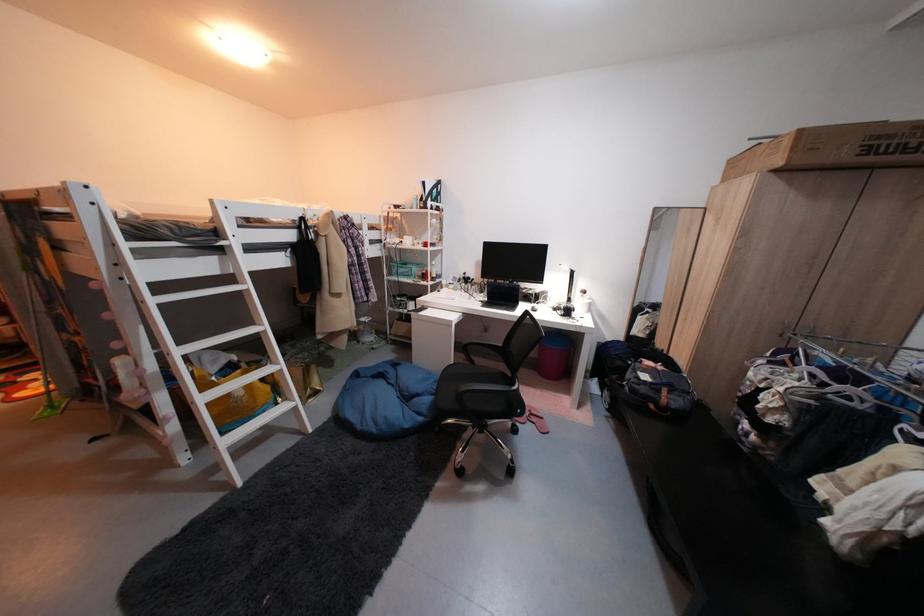
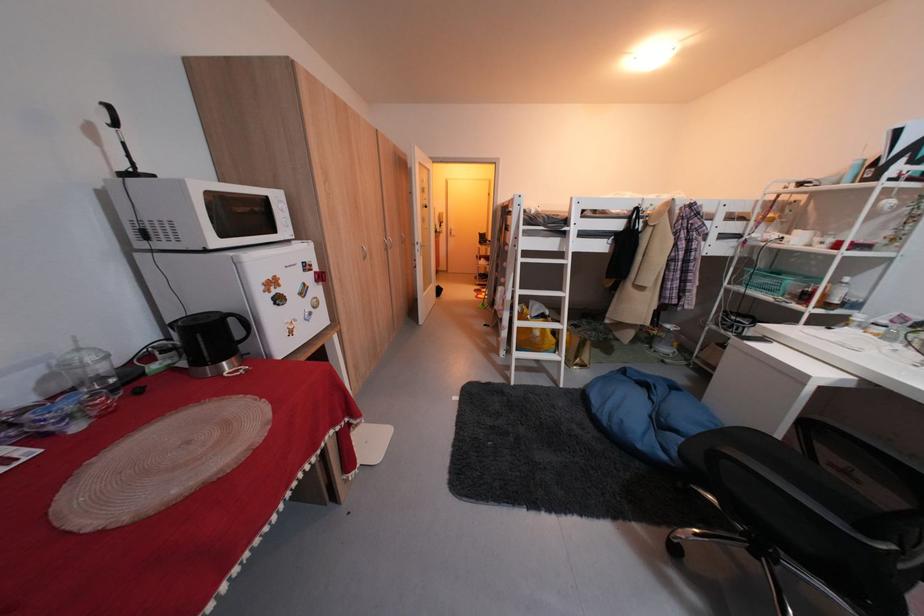
Question: The camera is either moving clockwise (left) or counter-clockwise (right) around the object. The first image is from the beginning of the video and the second image is from the end. Is the camera moving left or right when shooting the video?

Choices:
 (A) Left
 (B) Right

Answer: (B)